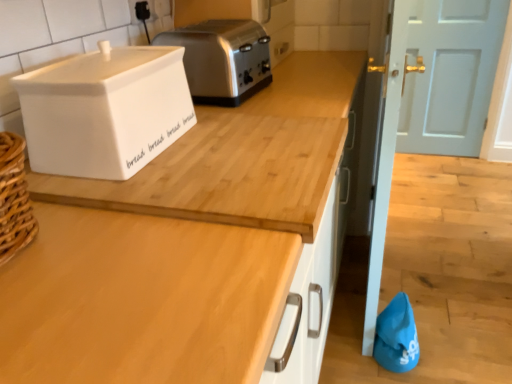
Question: Does wooden at upper center have a greater width compared to light blue painted wood door at upper right?

Choices:
 (A) yes
 (B) no

Answer: (A)

Question: From the image's perspective, is wooden at upper center located above light blue painted wood door at upper right?

Choices:
 (A) yes
 (B) no

Answer: (B)

Question: From a real-world perspective, is wooden at upper center positioned under light blue painted wood door at upper right based on gravity?

Choices:
 (A) no
 (B) yes

Answer: (B)

Question: Are wooden at upper center and light blue painted wood door at upper right beside each other?

Choices:
 (A) yes
 (B) no

Answer: (B)

Question: Is wooden at upper center closer to camera compared to light blue painted wood door at upper right?

Choices:
 (A) no
 (B) yes

Answer: (B)

Question: Is wooden at upper center outside of light blue painted wood door at upper right?

Choices:
 (A) no
 (B) yes

Answer: (B)

Question: Considering the relative positions of wooden at upper center and satin silver toaster at upper center in the image provided, is wooden at upper center behind satin silver toaster at upper center?

Choices:
 (A) yes
 (B) no

Answer: (B)

Question: Could you tell me if wooden at upper center is turned towards satin silver toaster at upper center?

Choices:
 (A) no
 (B) yes

Answer: (A)

Question: Is wooden at upper center not near satin silver toaster at upper center?

Choices:
 (A) no
 (B) yes

Answer: (A)

Question: Is satin silver toaster at upper center located within wooden at upper center?

Choices:
 (A) no
 (B) yes

Answer: (A)

Question: Considering the relative positions of wooden at upper center and satin silver toaster at upper center in the image provided, is wooden at upper center in front of satin silver toaster at upper center?

Choices:
 (A) no
 (B) yes

Answer: (B)

Question: Can you confirm if wooden at upper center is smaller than satin silver toaster at upper center?

Choices:
 (A) no
 (B) yes

Answer: (A)

Question: Is satin silver toaster at upper center behind white ceramic bread bin at upper left?

Choices:
 (A) yes
 (B) no

Answer: (A)